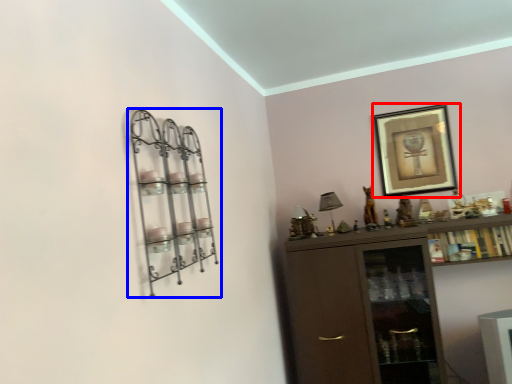
Question: Which of the following is the closest to the observer, picture frame (highlighted by a red box) or shelf (highlighted by a blue box)?

Choices:
 (A) picture frame
 (B) shelf

Answer: (B)